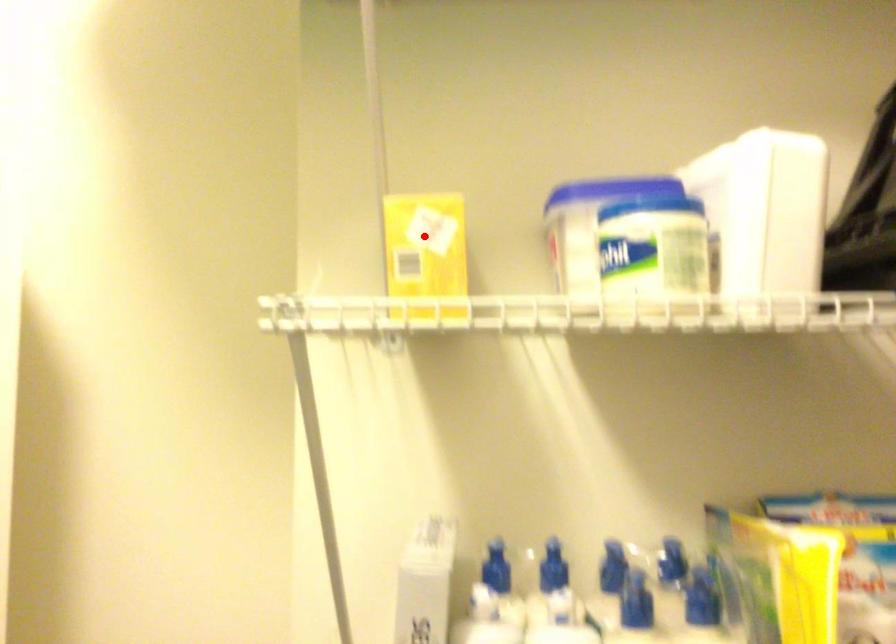
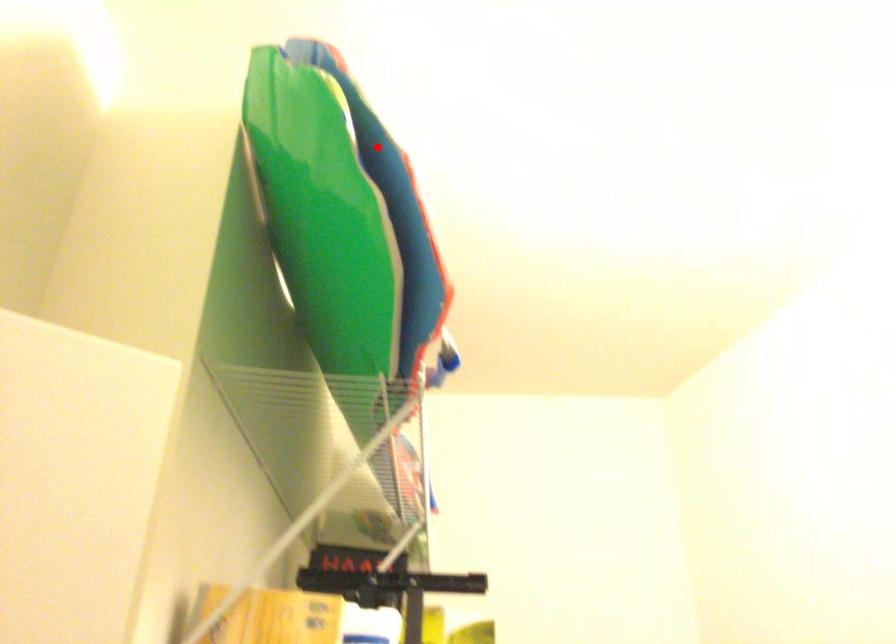
I am providing you with two images of the same scene from different viewpoints. A red point is marked on the first image and another point is marked on the second image. Is the marked point in image1 the same physical position as the marked point in image2?

→ No